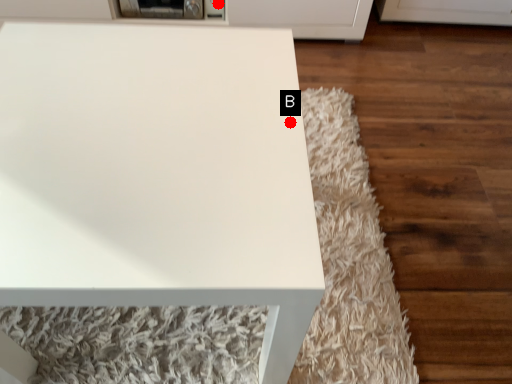
Question: Two points are circled on the image, labeled by A and B beside each circle. Which point is closer to the camera?

Choices:
 (A) A is closer
 (B) B is closer

Answer: (B)